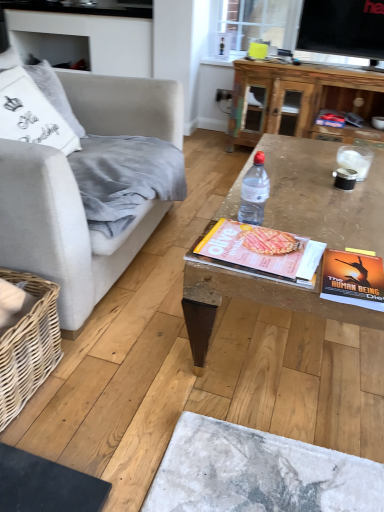
At what (x,y) coordinates should I click in order to perform the action: click on vacant area that lies between matte yellow magazine at center and clear plastic bottle at center. Please return your answer as a coordinate pair (x, y). Looking at the image, I should click on (276, 228).